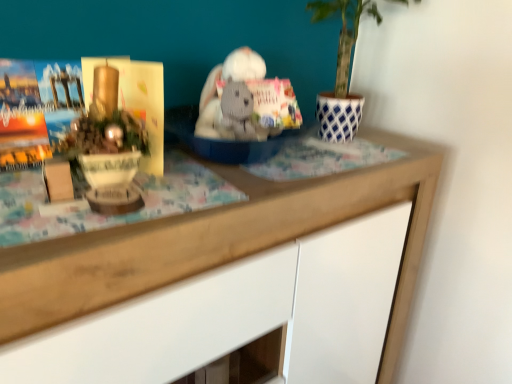
What do you see at coordinates (240, 114) in the screenshot? This screenshot has height=384, width=512. I see `white knitted bear at center` at bounding box center [240, 114].

Locate an element on the screen. matte gold paperback book at left is located at coordinates (136, 100).

The image size is (512, 384). I want to click on white knitted bear at center, so click(x=240, y=114).

From the image's perspective, which object appears higher, white knitted bear at center or wooden desk at center?

white knitted bear at center, from the image's perspective.

Is white knitted bear at center aimed at wooden desk at center?

No, white knitted bear at center is not turned towards wooden desk at center.

Looking at their sizes, would you say white knitted bear at center is wider or thinner than wooden desk at center?

In the image, white knitted bear at center appears to be more narrow than wooden desk at center.

Is matte gold paperback book at left touching white knitted bear at center?

No, matte gold paperback book at left is not next to white knitted bear at center.

Who is bigger, matte gold paperback book at left or white knitted bear at center?

With larger size is matte gold paperback book at left.

Identify the location of paperback book below the white knitted bear at center (from a real-world perspective). This screenshot has width=512, height=384. (136, 100).

Which object is more forward, matte gold paperback book at left or white knitted bear at center?

matte gold paperback book at left is closer to the camera.

Considering the positions of objects wooden desk at center and white knitted bear at center in the image provided, who is more to the right, wooden desk at center or white knitted bear at center?

Positioned to the right is white knitted bear at center.

Which is in front, wooden desk at center or white knitted bear at center?

wooden desk at center is more forward.

Is wooden desk at center in contact with white knitted bear at center?

There is a gap between wooden desk at center and white knitted bear at center.

What's the angular difference between wooden desk at center and matte gold paperback book at left's facing directions?

The facing directions of wooden desk at center and matte gold paperback book at left are 37.5 degrees apart.

In the scene shown: Which object is more forward, wooden desk at center or matte gold paperback book at left?

wooden desk at center is in front.

Is wooden desk at center looking in the opposite direction of matte gold paperback book at left?

wooden desk at center is not turned away from matte gold paperback book at left.

Considering the sizes of objects wooden desk at center and matte gold paperback book at left in the image provided, who is smaller, wooden desk at center or matte gold paperback book at left?

matte gold paperback book at left is smaller.

Is matte gold paperback book at left positioned with its back to wooden desk at center?

No, matte gold paperback book at left's orientation is not away from wooden desk at center.

Is the position of matte gold paperback book at left less distant than that of wooden desk at center?

No, matte gold paperback book at left is further to the viewer.

Is matte gold paperback book at left completely or partially outside of wooden desk at center?

Absolutely, matte gold paperback book at left is external to wooden desk at center.

Would you say matte gold paperback book at left is a long distance from wooden desk at center?

No, matte gold paperback book at left is in close proximity to wooden desk at center.

From the picture: Who is bigger, white knitted bear at center or matte gold paperback book at left?

With larger size is matte gold paperback book at left.

Can we say white knitted bear at center lies outside matte gold paperback book at left?

Absolutely, white knitted bear at center is external to matte gold paperback book at left.

Considering the relative positions of white knitted bear at center and matte gold paperback book at left in the image provided, is white knitted bear at center behind matte gold paperback book at left?

Yes, the depth of white knitted bear at center is greater than that of matte gold paperback book at left.

Based on the photo, from a real-world perspective, which is physically above, white knitted bear at center or matte gold paperback book at left?

In real-world perspective, white knitted bear at center is above.

Identify the location of desk below the white knitted bear at center (from a real-world perspective). (230, 281).

You are a GUI agent. You are given a task and a screenshot of the screen. Output one action in this format:
    pyautogui.click(x=<x>, y=<y>)
    Task: Click on the paperback book to the left of white knitted bear at center
    The image size is (512, 384).
    Given the screenshot: What is the action you would take?
    pyautogui.click(x=136, y=100)

Based on their spatial positions, is wooden desk at center or white knitted bear at center closer to matte gold paperback book at left?

The object closer to matte gold paperback book at left is white knitted bear at center.

Considering their positions, is matte gold paperback book at left positioned further to white knitted bear at center than wooden desk at center?

wooden desk at center is positioned further to the anchor white knitted bear at center.

Which object lies further to the anchor point wooden desk at center, white knitted bear at center or matte gold paperback book at left?

The object further to wooden desk at center is matte gold paperback book at left.

Considering their positions, is wooden desk at center positioned further to white knitted bear at center than matte gold paperback book at left?

Among the two, wooden desk at center is located further to white knitted bear at center.

Estimate the real-world distances between objects in this image. Which object is further from wooden desk at center, matte gold paperback book at left or white knitted bear at center?

Based on the image, matte gold paperback book at left appears to be further to wooden desk at center.

When comparing their distances from matte gold paperback book at left, does white knitted bear at center or wooden desk at center seem closer?

The object closer to matte gold paperback book at left is white knitted bear at center.

You are a GUI agent. You are given a task and a screenshot of the screen. Output one action in this format:
    pyautogui.click(x=<x>, y=<y>)
    Task: Click on the paperback book between white knitted bear at center and wooden desk at center from top to bottom
    This screenshot has width=512, height=384.
    Given the screenshot: What is the action you would take?
    pyautogui.click(x=136, y=100)